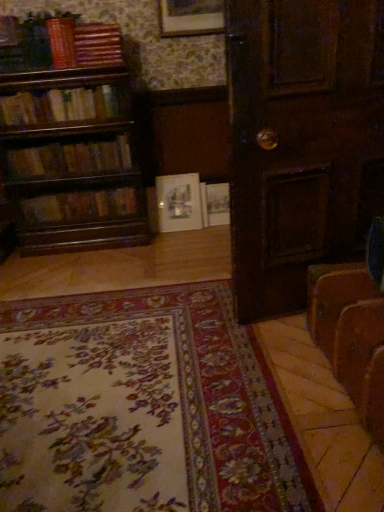
The width and height of the screenshot is (384, 512). What do you see at coordinates (62, 105) in the screenshot?
I see `wooden bookshelf at left, the fourth book ordered from the bottom` at bounding box center [62, 105].

You are a GUI agent. You are given a task and a screenshot of the screen. Output one action in this format:
    pyautogui.click(x=<x>, y=<y>)
    Task: Click on the white paper book at center, the 5th book when ordered from top to bottom
    
    Given the screenshot: What is the action you would take?
    (x=215, y=204)

I want to click on brown leather suitcase at lower right, so coord(351,336).

Which is more to the right, wooden bookshelf at left, marked as the 3th book in a bottom-to-top arrangement, or white paper book at center, the 5th book when ordered from top to bottom?

From the viewer's perspective, white paper book at center, the 5th book when ordered from top to bottom, appears more on the right side.

Which book is the 3rd one when counting from the left side of the white paper book at center, placed as the 2th book when sorted from bottom to top? Please provide its 2D coordinates.

[(70, 159)]

Is white paper book at center, placed as the 2th book when sorted from bottom to top, located within wooden bookshelf at left, marked as the 3th book in a bottom-to-top arrangement?

No, white paper book at center, placed as the 2th book when sorted from bottom to top, is located outside of wooden bookshelf at left, marked as the 3th book in a bottom-to-top arrangement.

From a real-world perspective, is wooden bookshelf at left, the fourth book when ordered from top to bottom, above or below white paper book at center, the 5th book when ordered from top to bottom?

Clearly, from a real-world perspective, wooden bookshelf at left, the fourth book when ordered from top to bottom, is above white paper book at center, the 5th book when ordered from top to bottom.

Is brown leather suitcase at lower right positioned in front of white matte picture frame at center, the second picture frame positioned from the top?

Yes, brown leather suitcase at lower right is closer to the camera.

Can you confirm if brown leather suitcase at lower right is taller than white matte picture frame at center, the second picture frame positioned from the top?

In fact, brown leather suitcase at lower right may be shorter than white matte picture frame at center, the second picture frame positioned from the top.

Considering the positions of points (357, 317) and (162, 193), is point (357, 317) closer to camera compared to point (162, 193)?

Yes.

Is brown leather suitcase at lower right bigger than white matte picture frame at center, which is the first picture frame in back-to-front order?

Indeed, brown leather suitcase at lower right has a larger size compared to white matte picture frame at center, which is the first picture frame in back-to-front order.

Considering the sizes of objects brown leather suitcase at lower right and wooden bookshelf at left, the fourth book when ordered from top to bottom, in the image provided, who is smaller, brown leather suitcase at lower right or wooden bookshelf at left, the fourth book when ordered from top to bottom,?

wooden bookshelf at left, the fourth book when ordered from top to bottom, is smaller.

Is brown leather suitcase at lower right to the left of wooden bookshelf at left, the fourth book when ordered from top to bottom, from the viewer's perspective?

No, brown leather suitcase at lower right is not to the left of wooden bookshelf at left, the fourth book when ordered from top to bottom.

In the scene shown: From a real-world perspective, who is located lower, brown leather suitcase at lower right or wooden bookshelf at left, the fourth book when ordered from top to bottom?

brown leather suitcase at lower right, from a real-world perspective.

Is wooden bookshelf at left, the fourth book when ordered from top to bottom, inside brown leather suitcase at lower right?

No, wooden bookshelf at left, the fourth book when ordered from top to bottom, is not a part of brown leather suitcase at lower right.

Is white matte picture frame at center, which is counted as the 2th picture frame, starting from the front, bigger than wooden book at upper left, positioned as the fifth book in bottom-to-top order?

Incorrect, white matte picture frame at center, which is counted as the 2th picture frame, starting from the front, is not larger than wooden book at upper left, positioned as the fifth book in bottom-to-top order.

Between white matte picture frame at center, the second picture frame positioned from the top, and wooden book at upper left, acting as the 2th book starting from the top, which one appears on the left side from the viewer's perspective?

From the viewer's perspective, wooden book at upper left, acting as the 2th book starting from the top, appears more on the left side.

Who is shorter, white matte picture frame at center, the second picture frame positioned from the top, or wooden book at upper left, acting as the 2th book starting from the top?

wooden book at upper left, acting as the 2th book starting from the top, is shorter.

In the scene shown: From the image's perspective, which is above, white matte picture frame at center, positioned as the first picture frame in bottom-to-top order, or wooden book at upper left, positioned as the fifth book in bottom-to-top order?

wooden book at upper left, positioned as the fifth book in bottom-to-top order, from the image's perspective.

Is wooden book at upper left, acting as the 2th book starting from the top, next to hardcover book at left, which ranks as the sixth book in top-to-bottom order, and touching it?

wooden book at upper left, acting as the 2th book starting from the top, is not next to hardcover book at left, which ranks as the sixth book in top-to-bottom order, and they're not touching.

Between wooden book at upper left, acting as the 2th book starting from the top, and hardcover book at left, which appears as the first book when ordered from the bottom, which one has smaller width?

hardcover book at left, which appears as the first book when ordered from the bottom.

Considering the relative positions of wooden book at upper left, acting as the 2th book starting from the top, and hardcover book at left, which ranks as the sixth book in top-to-bottom order, in the image provided, is wooden book at upper left, acting as the 2th book starting from the top, to the right of hardcover book at left, which ranks as the sixth book in top-to-bottom order, from the viewer's perspective?

In fact, wooden book at upper left, acting as the 2th book starting from the top, is to the left of hardcover book at left, which ranks as the sixth book in top-to-bottom order.

Does point (96, 38) come closer to viewer compared to point (374, 331)?

No, (96, 38) is further to viewer.

In the image, is wooden book at upper left, positioned as the fifth book in bottom-to-top order, positioned in front of or behind brown leather suitcase at lower right?

wooden book at upper left, positioned as the fifth book in bottom-to-top order, is positioned farther from the viewer than brown leather suitcase at lower right.

Looking at this image, which object is thinner, wooden book at upper left, positioned as the fifth book in bottom-to-top order, or brown leather suitcase at lower right?

Thinner between the two is wooden book at upper left, positioned as the fifth book in bottom-to-top order.

Considering the sizes of wooden book at upper left, positioned as the fifth book in bottom-to-top order, and brown leather suitcase at lower right in the image, is wooden book at upper left, positioned as the fifth book in bottom-to-top order, taller or shorter than brown leather suitcase at lower right?

Clearly, wooden book at upper left, positioned as the fifth book in bottom-to-top order, is shorter compared to brown leather suitcase at lower right.

Does floral carpet at lower center have a greater height compared to wooden bookshelf at left, the fourth book ordered from the bottom?

No.

From a real-world perspective, is floral carpet at lower center positioned above or below wooden bookshelf at left, acting as the 3th book starting from the top?

Clearly, from a real-world perspective, floral carpet at lower center is below wooden bookshelf at left, acting as the 3th book starting from the top.

Is the depth of floral carpet at lower center less than that of wooden bookshelf at left, acting as the 3th book starting from the top?

Yes, floral carpet at lower center is closer to the camera.

Which object is positioned more to the right, floral carpet at lower center or wooden bookshelf at left, acting as the 3th book starting from the top?

Positioned to the right is floral carpet at lower center.

I want to click on the 2nd book behind the wooden bookshelf at left, marked as the 3th book in a bottom-to-top arrangement, so click(215, 204).

I want to click on the 1st picture frame above the brown leather suitcase at lower right (from the image's perspective), so click(x=179, y=202).

In the scene shown: From the image, which object appears to be farther from wooden bookshelf at left, the fourth book when ordered from top to bottom, hardcover book at left, which ranks as the sixth book in top-to-bottom order, or wooden book at upper left, acting as the 2th book starting from the top?

wooden book at upper left, acting as the 2th book starting from the top, is further to wooden bookshelf at left, the fourth book when ordered from top to bottom.

In the scene shown: Based on their spatial positions, is wooden book at upper left, acting as the 2th book starting from the top, or hardcover book at left, which appears as the first book when ordered from the bottom, closer to floral carpet at lower center?

Based on the image, hardcover book at left, which appears as the first book when ordered from the bottom, appears to be nearer to floral carpet at lower center.

Which object lies nearer to the anchor point hardcover book at left, which ranks as the sixth book in top-to-bottom order, wooden bookshelf at left, acting as the 3th book starting from the top, or dark wood door at center?

wooden bookshelf at left, acting as the 3th book starting from the top, lies closer to hardcover book at left, which ranks as the sixth book in top-to-bottom order, than the other object.

Which object lies further to the anchor point wooden book at upper left, arranged as the first book when viewed from the top, floral carpet at lower center or hardcover book at left, which appears as the first book when ordered from the bottom?

floral carpet at lower center is positioned further to the anchor wooden book at upper left, arranged as the first book when viewed from the top.

From the image, which object appears to be farther from wooden picture frame at upper center, the 2th picture frame in the back-to-front sequence, wooden book at upper left, acting as the 2th book starting from the top, or wooden bookshelf at left, acting as the 3th book starting from the top?

wooden bookshelf at left, acting as the 3th book starting from the top, is further to wooden picture frame at upper center, the 2th picture frame in the back-to-front sequence.

Which object lies nearer to the anchor point wooden book at upper left, positioned as the fifth book in bottom-to-top order, hardcover book at left, which ranks as the sixth book in top-to-bottom order, or white matte picture frame at center, which is the first picture frame in back-to-front order?

hardcover book at left, which ranks as the sixth book in top-to-bottom order, lies closer to wooden book at upper left, positioned as the fifth book in bottom-to-top order, than the other object.

Based on their spatial positions, is brown leather suitcase at lower right or wooden bookshelf at left, marked as the 3th book in a bottom-to-top arrangement, further from floral carpet at lower center?

The object further to floral carpet at lower center is wooden bookshelf at left, marked as the 3th book in a bottom-to-top arrangement.

Which object lies nearer to the anchor point wooden bookshelf at left, marked as the 3th book in a bottom-to-top arrangement, brown leather suitcase at lower right or dark wood door at center?

dark wood door at center lies closer to wooden bookshelf at left, marked as the 3th book in a bottom-to-top arrangement, than the other object.

Find the location of a particular element. picture frame located between floral carpet at lower center and white matte picture frame at center, positioned as the first picture frame in bottom-to-top order, in the depth direction is located at coordinates (191, 17).

At what (x,y) coordinates should I click in order to perform the action: click on door located between floral carpet at lower center and brown leather suitcase at lower right in the left-right direction. Please return your answer as a coordinate pair (x, y). This screenshot has width=384, height=512. Looking at the image, I should click on (301, 141).

Locate an element on the screen. This screenshot has width=384, height=512. picture frame positioned between brown leather suitcase at lower right and hardcover book at left, which appears as the first book when ordered from the bottom, from near to far is located at coordinates pyautogui.click(x=191, y=17).

Identify the location of picture frame between wooden book at upper left, acting as the 2th book starting from the top, and hardcover book at left, which ranks as the sixth book in top-to-bottom order, vertically. The height and width of the screenshot is (512, 384). (179, 202).